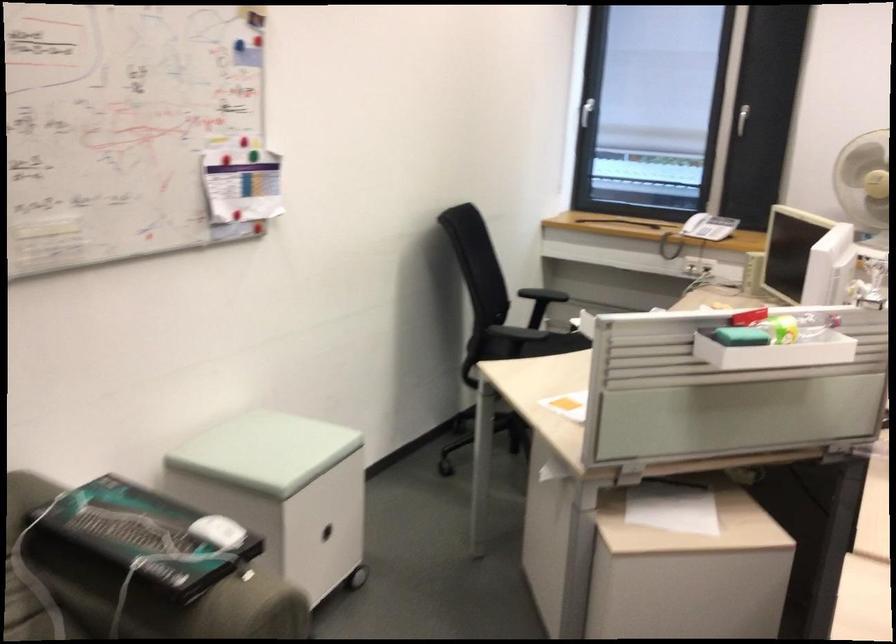
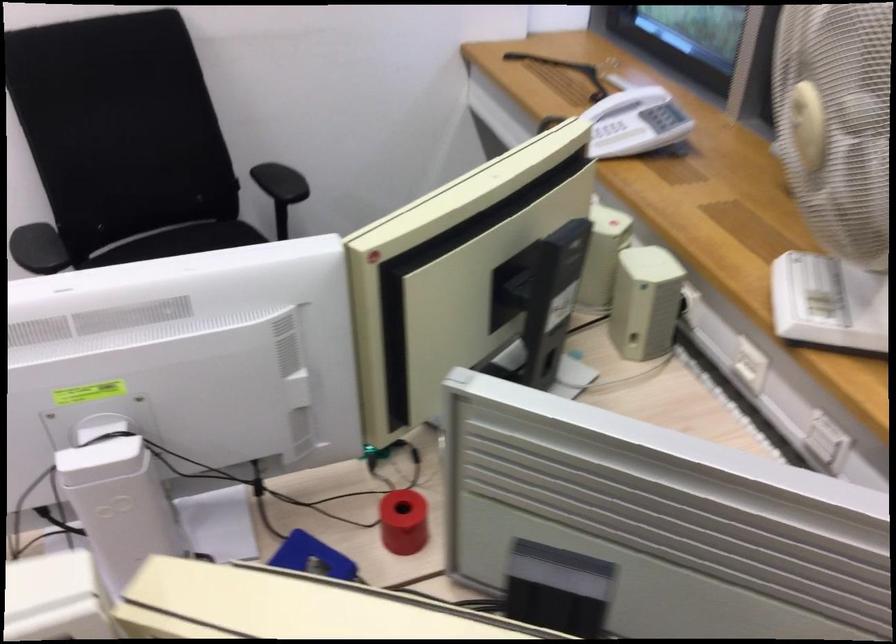
The point at (487,337) is marked in the first image. Where is the corresponding point in the second image?

(179, 240)